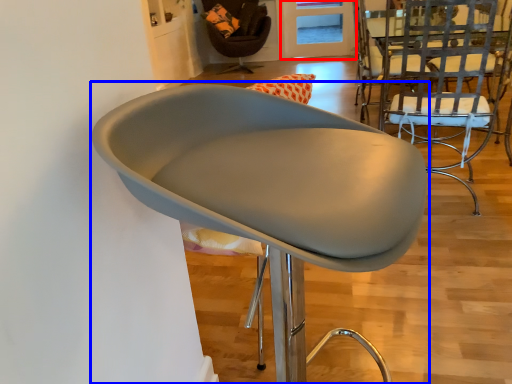
Question: Which object appears closest to the camera in this image, glass door (highlighted by a red box) or chair (highlighted by a blue box)?

Choices:
 (A) glass door
 (B) chair

Answer: (B)